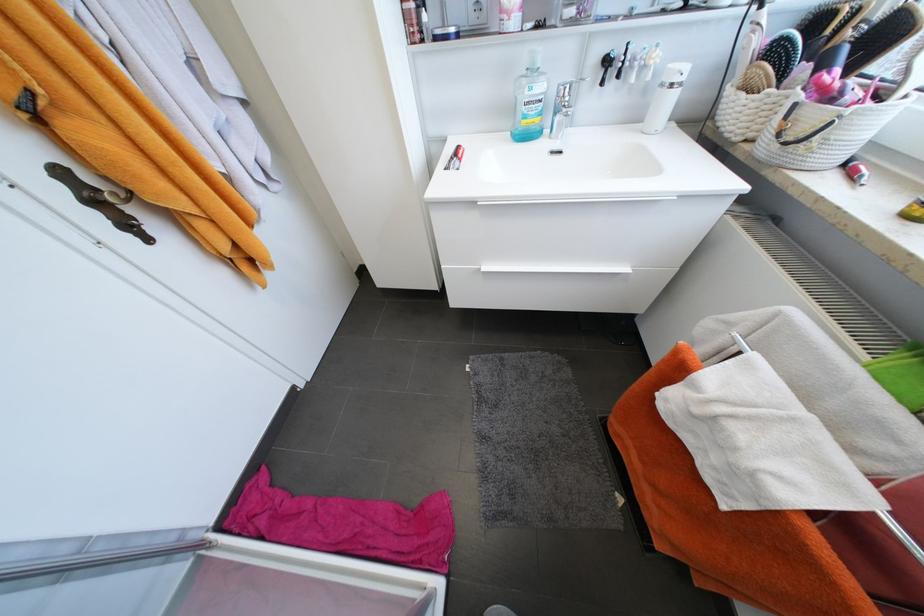
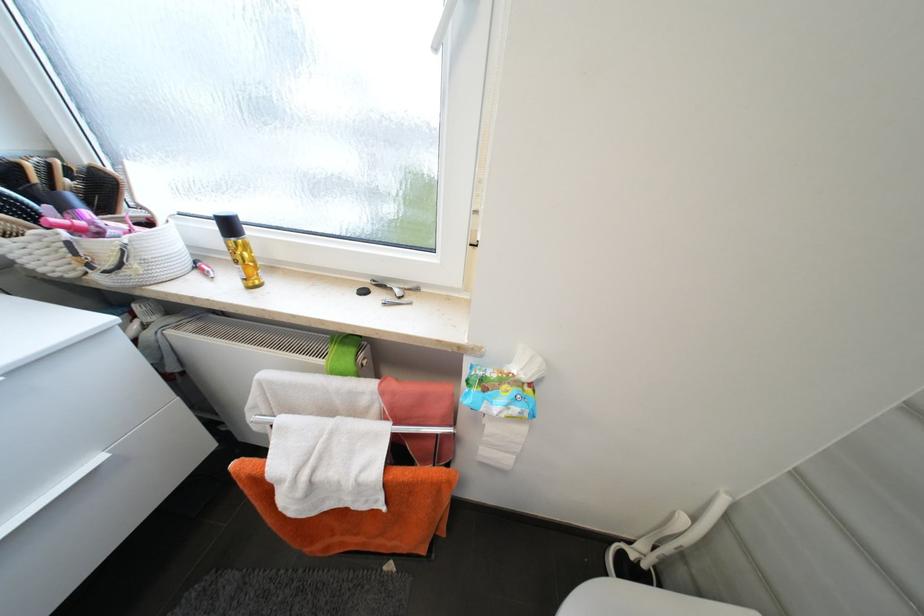
The images are taken continuously from a first-person perspective. In which direction is your viewpoint rotating?

The camera rotated toward right-down.